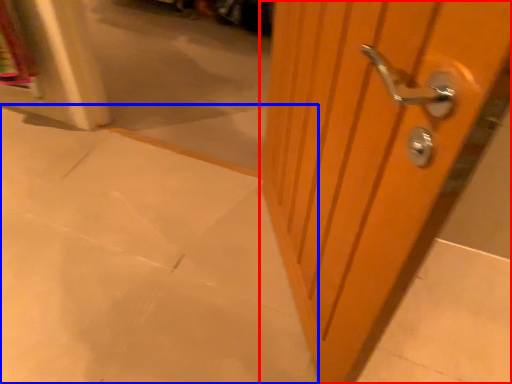
Question: Among these objects, which one is farthest to the camera, door (highlighted by a red box) or concrete (highlighted by a blue box)?

Choices:
 (A) door
 (B) concrete

Answer: (B)